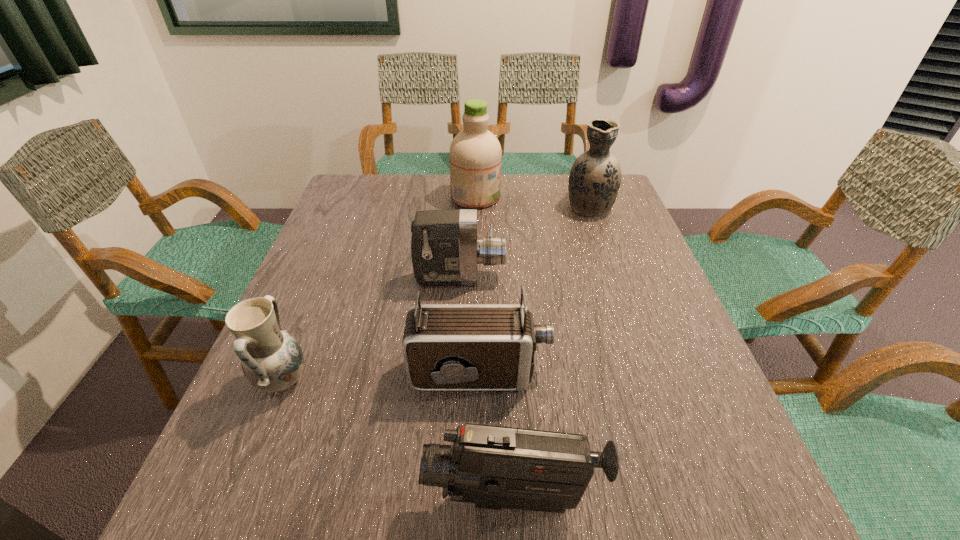
You are a GUI agent. You are given a task and a screenshot of the screen. Output one action in this format:
    pyautogui.click(x=<x>, y=<y>)
    Task: Click on the unoccupied area between the cleansing agent and the vase
    
    Given the screenshot: What is the action you would take?
    pyautogui.click(x=533, y=201)

This screenshot has width=960, height=540. Find the location of `free space between the nearest camcorder and the rightmost object`. free space between the nearest camcorder and the rightmost object is located at coordinates (550, 352).

Find the location of a particular element. The height and width of the screenshot is (540, 960). unoccupied area between the rightmost object and the pottery is located at coordinates (436, 293).

Locate which object ranks fourth in proximity to the second farthest camcorder. Please provide its 2D coordinates. Your answer should be formatted as a tuple, i.e. [(x, y)], where the tuple contains the x and y coordinates of a point satisfying the conditions above.

[(595, 177)]

This screenshot has width=960, height=540. What are the coordinates of `object that is the fourth closest to the farthest camcorder` in the screenshot? It's located at (595, 177).

The image size is (960, 540). Find the location of `camcorder object that ranks as the closest to the rightmost object`. camcorder object that ranks as the closest to the rightmost object is located at coordinates (445, 250).

Select which camcorder is the third closest to the cleansing agent. Please provide its 2D coordinates. Your answer should be formatted as a tuple, i.e. [(x, y)], where the tuple contains the x and y coordinates of a point satisfying the conditions above.

[(494, 467)]